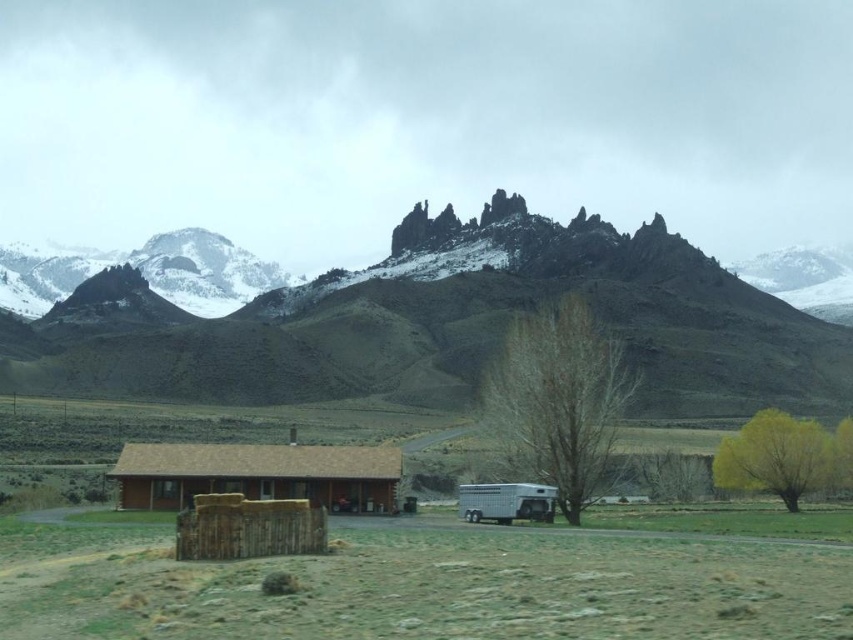
Question: Does brown log cabin at center have a smaller size compared to yellow leafy tree at lower right?

Choices:
 (A) no
 (B) yes

Answer: (B)

Question: Which point is farther to the camera?

Choices:
 (A) white glossy horse trailer at lower right
 (B) bare wood tree at center
 (C) brown log cabin at center
 (D) rugged rock formation at center

Answer: (D)

Question: Which point is farther from the camera taking this photo?

Choices:
 (A) (534, 513)
 (B) (512, 428)
 (C) (271, 472)
 (D) (834, 449)

Answer: (D)

Question: Considering the real-world distances, which object is farthest from the brown log cabin at center?

Choices:
 (A) bare wood tree at center
 (B) yellow leafy tree at lower right

Answer: (B)

Question: Is rugged rock formation at center thinner than brown log cabin at center?

Choices:
 (A) yes
 (B) no

Answer: (B)

Question: Can you confirm if rugged rock formation at center is bigger than white glossy horse trailer at lower right?

Choices:
 (A) no
 (B) yes

Answer: (B)